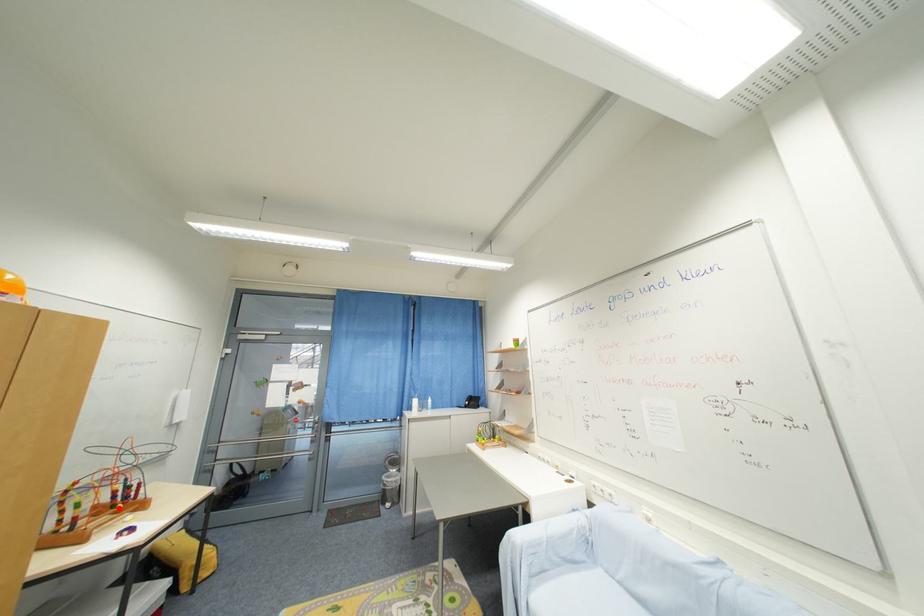
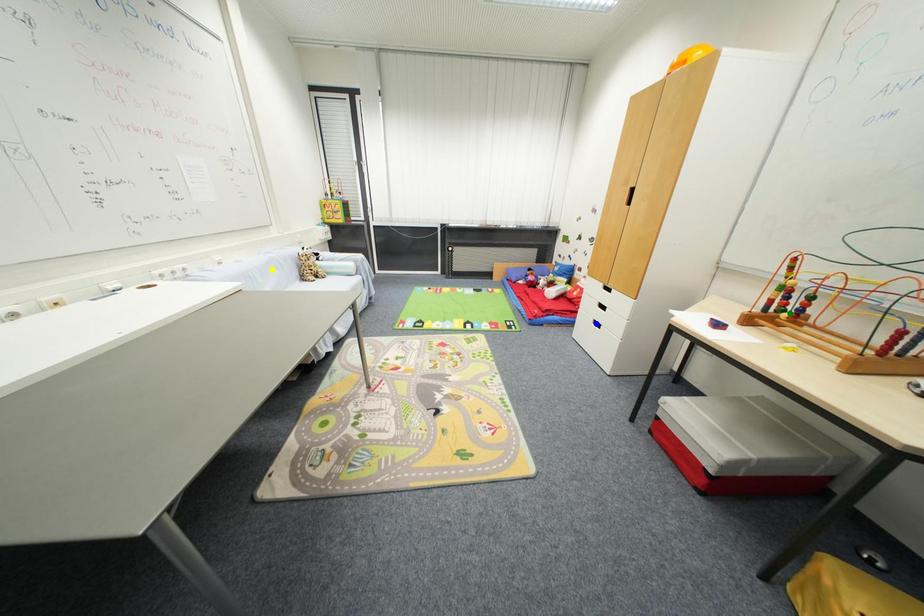
Question: I am providing you with two images of the same scene from different viewpoints. A red point is marked on the first image. You are given multiple points on the second image. Which point in image 2 is actually the same real-world point as the red point in image 1?

Choices:
 (A) yellow point
 (B) blue point
 (C) green point

Answer: (C)